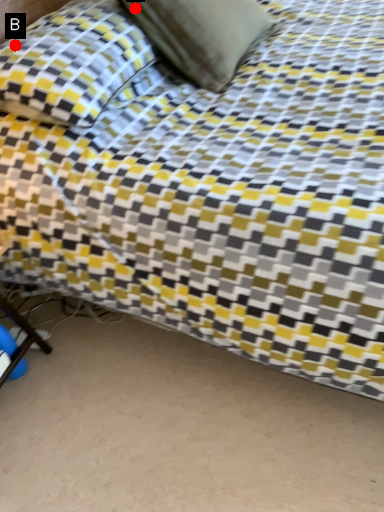
Question: Two points are circled on the image, labeled by A and B beside each circle. Among these points, which one is nearest to the camera?

Choices:
 (A) A is closer
 (B) B is closer

Answer: (B)